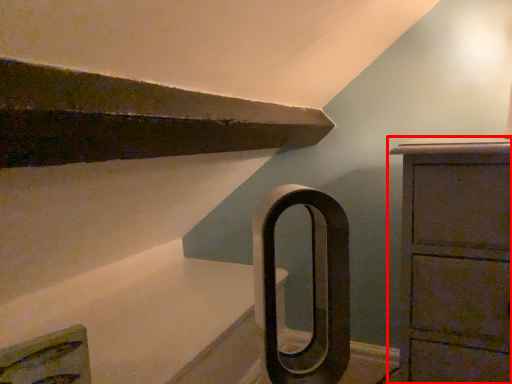
Question: In this image, where is chest of drawers (annotated by the red box) located relative to door handle?

Choices:
 (A) right
 (B) left

Answer: (A)